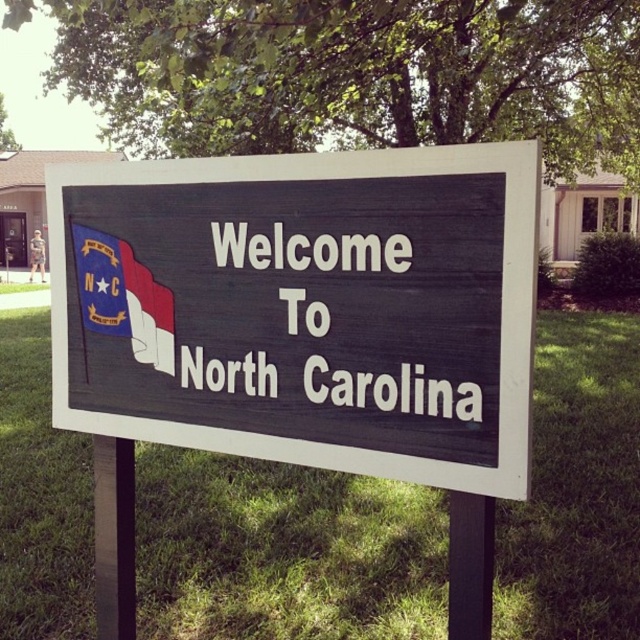
Question: Which point appears closest to the camera in this image?

Choices:
 (A) (326, 442)
 (B) (125, 280)
 (C) (632, 516)

Answer: (A)

Question: Which object is the farthest from the dark wood sign at center?

Choices:
 (A) green grass at center
 (B) matte red flag at upper left

Answer: (A)

Question: Does dark wood sign at center come in front of green grass at center?

Choices:
 (A) no
 (B) yes

Answer: (B)

Question: Observing the image, what is the correct spatial positioning of green grass at center in reference to matte red flag at upper left?

Choices:
 (A) right
 (B) left

Answer: (A)

Question: Can you confirm if dark wood sign at center is positioned to the right of matte red flag at upper left?

Choices:
 (A) no
 (B) yes

Answer: (B)

Question: Which object is the farthest from the matte red flag at upper left?

Choices:
 (A) green grass at center
 (B) dark wood sign at center

Answer: (A)